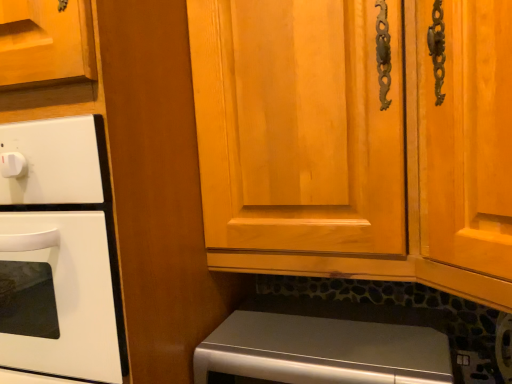
Identify the location of satin silver microwave at lower center. Image resolution: width=512 pixels, height=384 pixels. (323, 351).

The image size is (512, 384). Describe the element at coordinates (323, 351) in the screenshot. I see `satin silver microwave at lower center` at that location.

What is the approximate width of satin silver microwave at lower center?

satin silver microwave at lower center is 14.33 inches in width.

What are the coordinates of `satin silver microwave at lower center` in the screenshot? It's located at (323, 351).